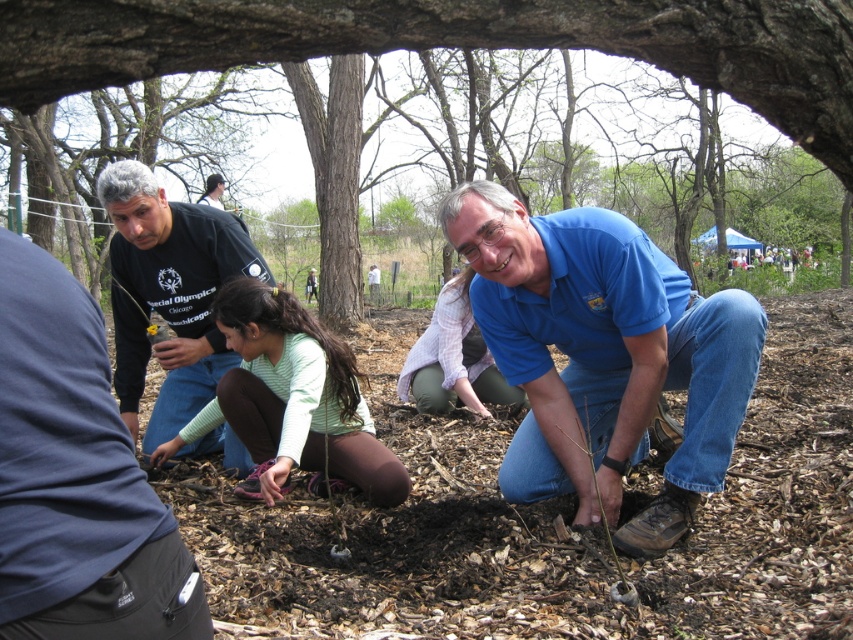
Can you confirm if brown mulch at center is smaller than light purple shirt at center?

Correct, brown mulch at center occupies less space than light purple shirt at center.

Is brown mulch at center closer to the viewer compared to light purple shirt at center?

That is True.

Measure the distance between point (798, 74) and camera.

Point (798, 74) and camera are 1.84 meters apart.

Find the location of a particular element. The height and width of the screenshot is (640, 853). brown mulch at center is located at coordinates (453, 44).

Which is below, blue cotton shirt at center or light purple shirt at center?

Positioned lower is blue cotton shirt at center.

What do you see at coordinates (602, 355) in the screenshot? This screenshot has width=853, height=640. I see `blue cotton shirt at center` at bounding box center [602, 355].

Identify the location of blue cotton shirt at center. (602, 355).

Is dark blue shirt at left below green matte shirt at center?

No.

Who is positioned more to the right, dark blue shirt at left or green matte shirt at center?

green matte shirt at center is more to the right.

Which is in front, point (184, 224) or point (379, 472)?

Point (379, 472) is more forward.

Where is `dark blue shirt at left`? dark blue shirt at left is located at coordinates (169, 294).